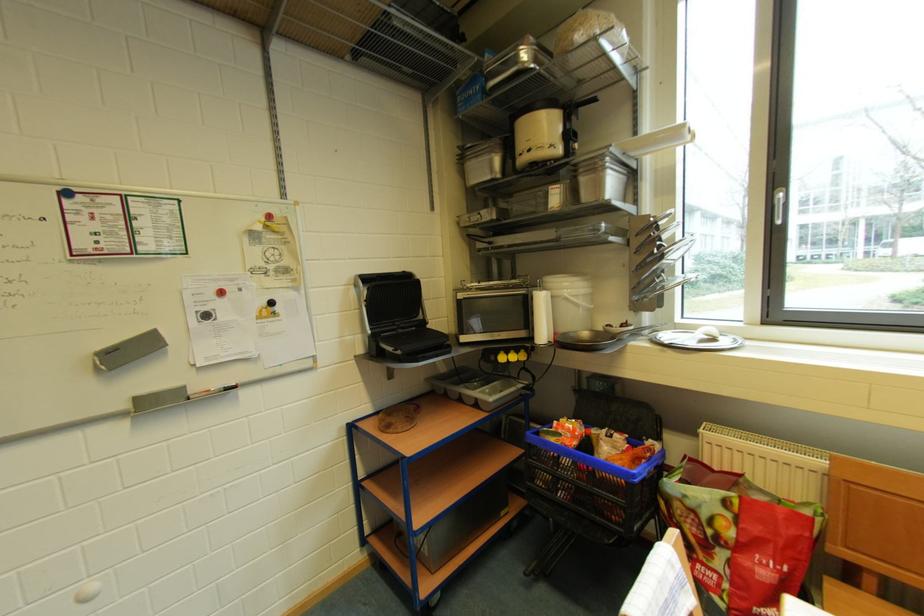
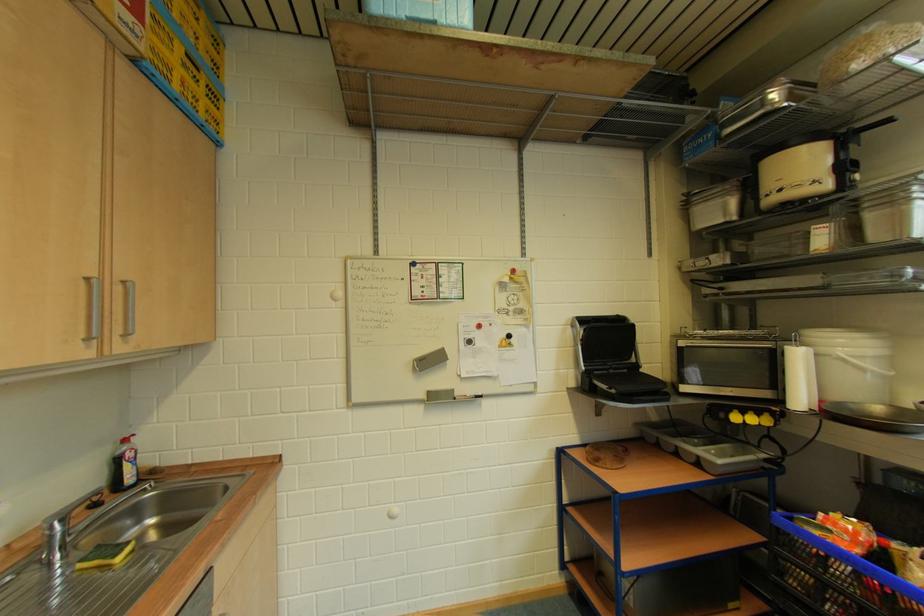
In the second image, find the point that corresponds to [602,435] in the first image.

(905, 549)